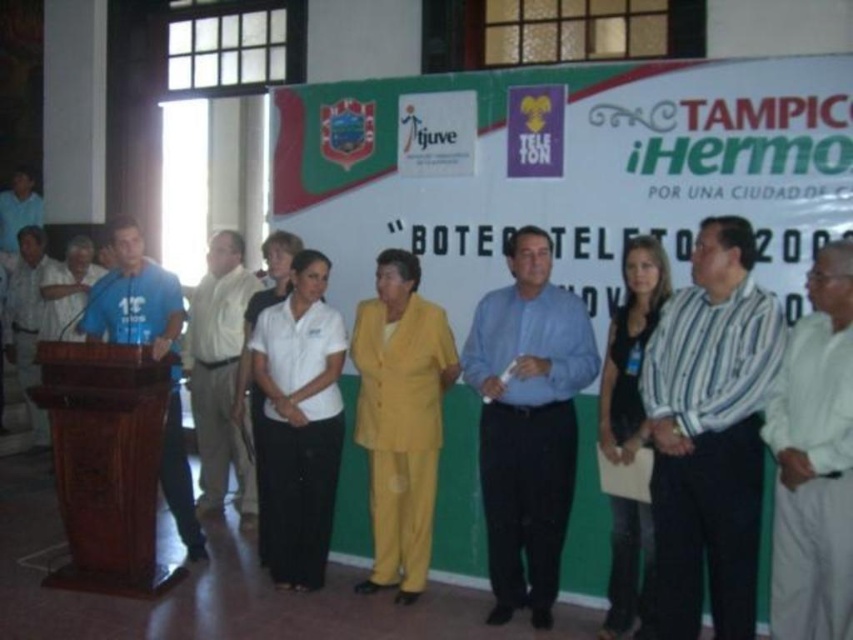
Who is more forward, (73, 554) or (416, 372)?

Point (416, 372) is in front.

Is point (167, 588) less distant than point (381, 497)?

Yes.

Find the location of `brown polished wood podium at left`. brown polished wood podium at left is located at coordinates (106, 461).

The height and width of the screenshot is (640, 853). Describe the element at coordinates (106, 461) in the screenshot. I see `brown polished wood podium at left` at that location.

Between point (136, 573) and point (161, 292), which one is positioned behind?

Point (161, 292)

Locate an element on the screen. Image resolution: width=853 pixels, height=640 pixels. brown polished wood podium at left is located at coordinates (106, 461).

Describe the element at coordinates (399, 419) in the screenshot. I see `yellow fabric suit at center` at that location.

The height and width of the screenshot is (640, 853). Describe the element at coordinates (399, 419) in the screenshot. I see `yellow fabric suit at center` at that location.

The height and width of the screenshot is (640, 853). Find the location of `yellow fabric suit at center`. yellow fabric suit at center is located at coordinates (399, 419).